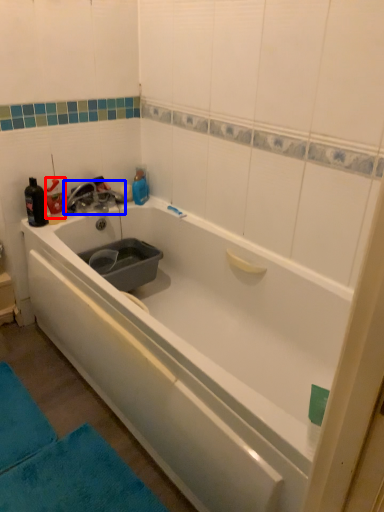
Question: Which object is closer to the camera taking this photo, bottle (highlighted by a red box) or tap (highlighted by a blue box)?

Choices:
 (A) bottle
 (B) tap

Answer: (A)